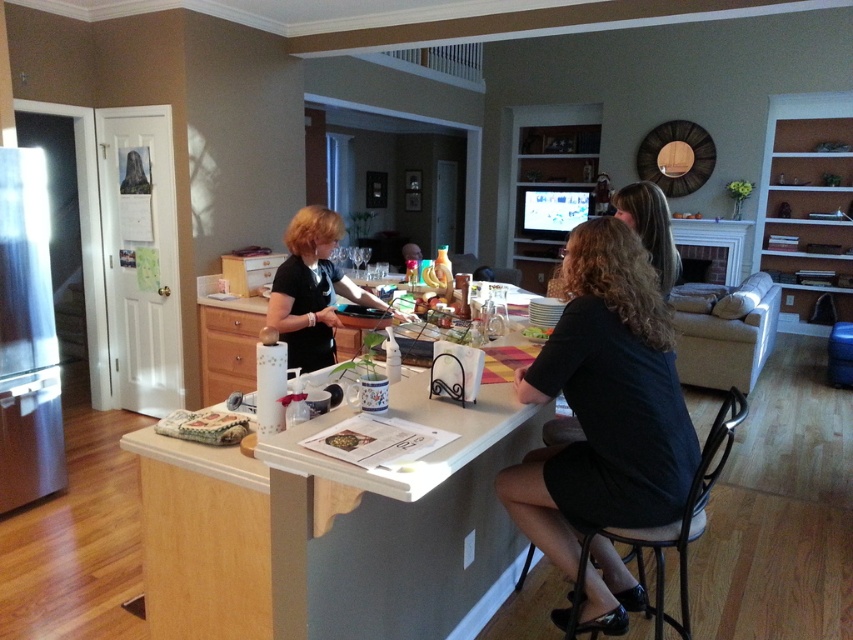
Question: Is black fabric shirt at center thinner than blonde hair at center?

Choices:
 (A) no
 (B) yes

Answer: (A)

Question: Which point is farther from the camera taking this photo?

Choices:
 (A) (454, 464)
 (B) (763, 323)
 (C) (595, 385)

Answer: (B)

Question: Estimate the real-world distances between objects in this image. Which object is farther from the black matte shirt at center?

Choices:
 (A) black fabric shirt at center
 (B) light brown laminate counter top at center

Answer: (A)

Question: Can you confirm if black fabric shirt at center is wider than blonde hair at center?

Choices:
 (A) yes
 (B) no

Answer: (A)

Question: Can you confirm if black fabric shirt at center is smaller than beige fabric couch at right?

Choices:
 (A) no
 (B) yes

Answer: (B)

Question: Which point appears farthest from the camera in this image?

Choices:
 (A) (641, 381)
 (B) (646, 241)
 (C) (432, 461)

Answer: (B)